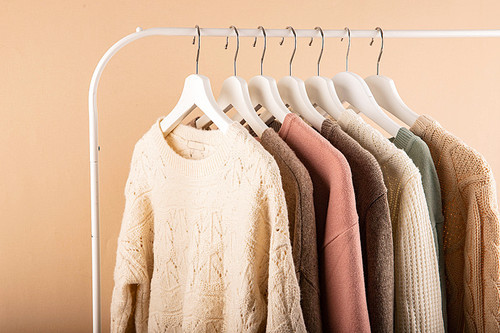
This screenshot has height=333, width=500. I want to click on chrome plated clothes hanger hook, so point(198,42), point(239,41), point(266,42), point(296,43), point(322,43), point(350,43), point(383,42).